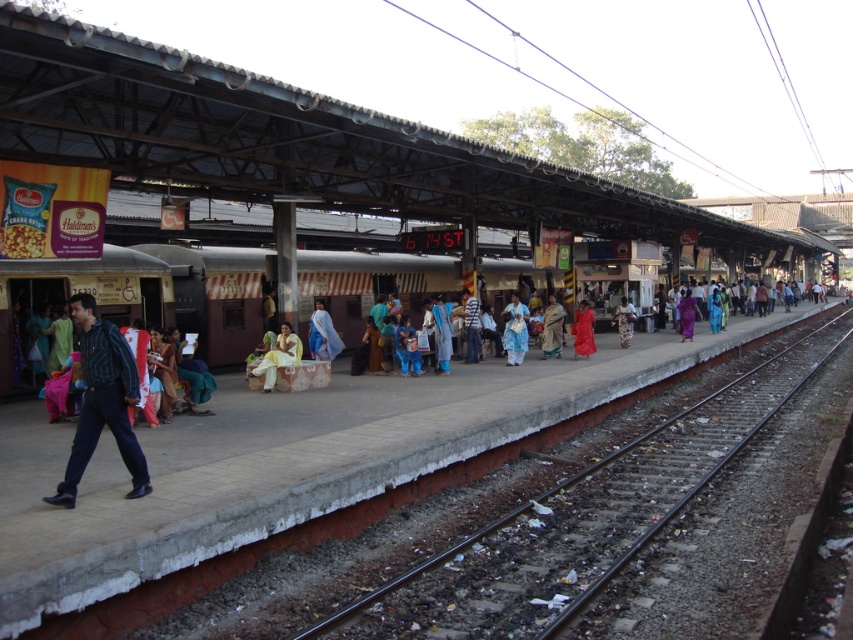
Question: Considering the relative positions of blue striped shirt at center and light blue shirt at center in the image provided, where is blue striped shirt at center located with respect to light blue shirt at center?

Choices:
 (A) left
 (B) right

Answer: (A)

Question: Which is farther from the blue striped shirt at center?

Choices:
 (A) smooth metal train track at center
 (B) white cotton dress at center

Answer: (B)

Question: Can you confirm if blue fabric saree at center is positioned to the left of purple silk saree at center?

Choices:
 (A) yes
 (B) no

Answer: (A)

Question: Considering the real-world distances, which object is closest to the blue fabric saree at center?

Choices:
 (A) silk sari at center
 (B) blue striped shirt at center
 (C) white cotton dress at center
 (D) light blue fabric at center

Answer: (A)

Question: Which point is farther to the camera?

Choices:
 (A) matte yellow dress at center
 (B) blue striped shirt at center
 (C) light blue shirt at center

Answer: (C)

Question: Is brown painted train at center in front of blue striped shirt at center?

Choices:
 (A) no
 (B) yes

Answer: (A)